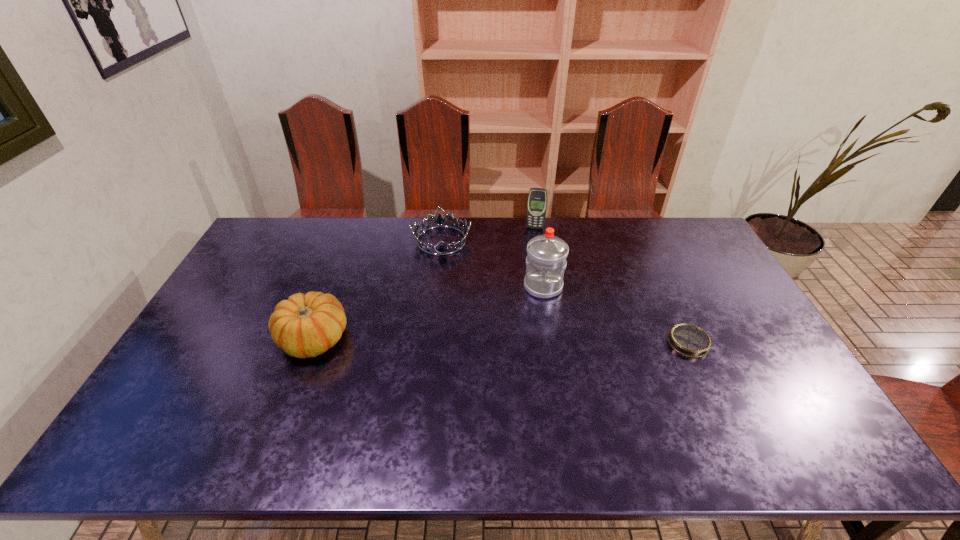
Locate an element on the screen. This screenshot has height=540, width=960. free space located 0.350m on the back of the shortest object is located at coordinates (647, 254).

Locate an element on the screen. free space located 0.160m on the screen of the fourth shortest object is located at coordinates (530, 255).

At what (x,y) coordinates should I click in order to perform the action: click on free region located 0.070m on the screen of the fourth shortest object. Please return your answer as a coordinate pair (x, y). Looking at the image, I should click on (532, 241).

The width and height of the screenshot is (960, 540). Find the location of `blank space located on the screen of the fourth shortest object`. blank space located on the screen of the fourth shortest object is located at coordinates (523, 302).

Find the location of a particular element. free space located 0.340m on the handle side of the third farthest object is located at coordinates click(x=531, y=390).

The image size is (960, 540). Find the location of `free location located 0.230m on the handle side of the third farthest object`. free location located 0.230m on the handle side of the third farthest object is located at coordinates (535, 357).

Identify the location of free space located on the handle side of the third farthest object. (534, 371).

Find the location of a particular element. vacant space located on the front-facing side of the second shortest object is located at coordinates (446, 313).

Where is `free space located on the front-facing side of the second shortest object`? This screenshot has width=960, height=540. free space located on the front-facing side of the second shortest object is located at coordinates (445, 303).

Find the location of a particular element. vacant area situated on the front-facing side of the second shortest object is located at coordinates click(x=444, y=274).